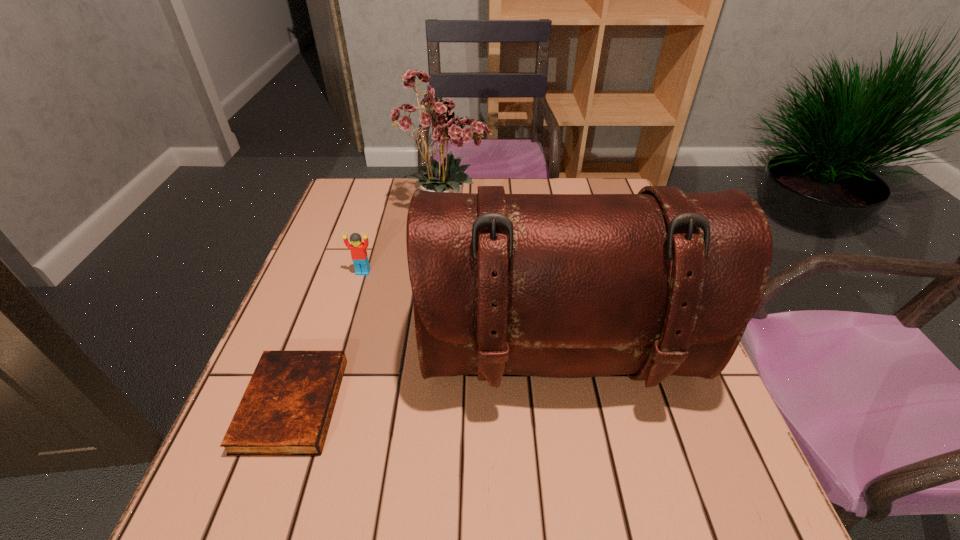
You are a GUI agent. You are given a task and a screenshot of the screen. Output one action in this format:
    pyautogui.click(x=<x>, y=<y>)
    Task: Click on the empty space that is in between the flower arrangement and the Bible
    The height and width of the screenshot is (540, 960).
    Given the screenshot: What is the action you would take?
    pyautogui.click(x=370, y=308)

Where is `free space between the Bible and the satchel`? This screenshot has width=960, height=540. free space between the Bible and the satchel is located at coordinates (425, 380).

In order to click on blank region between the satchel and the shortest object in this screenshot , I will do `click(425, 380)`.

The image size is (960, 540). Identify the location of blank region between the second shortest object and the Bible. (327, 338).

Find the location of a particular element. The width and height of the screenshot is (960, 540). free space between the shortest object and the Lego is located at coordinates (327, 338).

Choose which object is the second nearest neighbor to the satchel. Please provide its 2D coordinates. Your answer should be formatted as a tuple, i.e. [(x, y)], where the tuple contains the x and y coordinates of a point satisfying the conditions above.

[(358, 248)]

The width and height of the screenshot is (960, 540). Identify the location of object that stands as the second closest to the Lego. (659, 283).

The image size is (960, 540). Find the location of `free space that satisfies the following two spatial constraints: 1. on the face of the second farthest object; 2. on the spine side of the Bible`. free space that satisfies the following two spatial constraints: 1. on the face of the second farthest object; 2. on the spine side of the Bible is located at coordinates (324, 404).

This screenshot has height=540, width=960. What are the coordinates of `vacant point that satisfies the following two spatial constraints: 1. on the front-facing side of the satchel; 2. on the spine side of the Bible` in the screenshot? It's located at click(x=566, y=404).

Where is `vacant point that satisfies the following two spatial constraints: 1. on the front-facing side of the flower arrangement; 2. on the face of the third nearest object`? Image resolution: width=960 pixels, height=540 pixels. vacant point that satisfies the following two spatial constraints: 1. on the front-facing side of the flower arrangement; 2. on the face of the third nearest object is located at coordinates (441, 272).